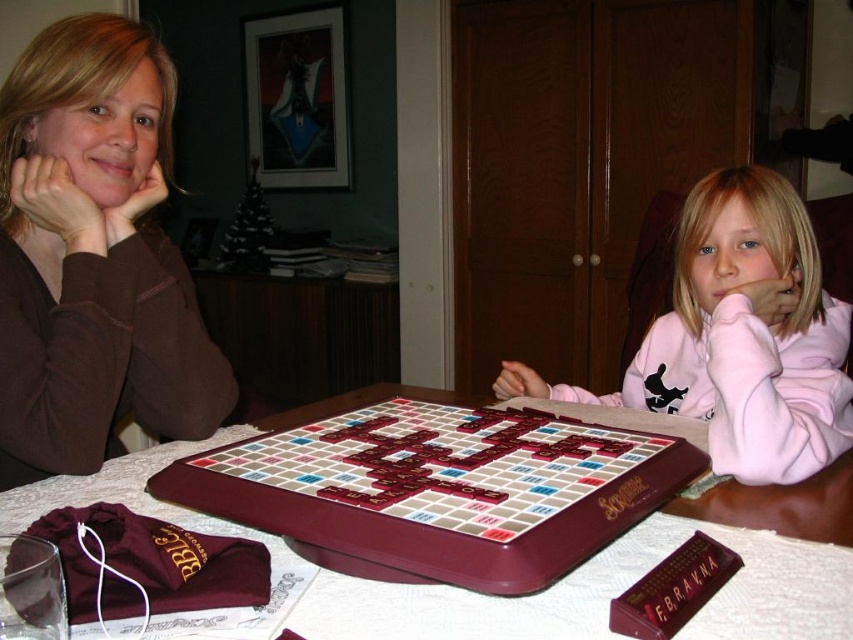
Question: Is maroon wooden table at center below maroon plastic scrabble board at center?

Choices:
 (A) yes
 (B) no

Answer: (A)

Question: Which point is farther to the camera?

Choices:
 (A) maroon wooden table at center
 (B) maroon plastic scrabble board at center

Answer: (B)

Question: Does brown fabric at left appear on the left side of pink fleece sweatshirt at right?

Choices:
 (A) yes
 (B) no

Answer: (A)

Question: Which point is closer to the camera?

Choices:
 (A) (733, 348)
 (B) (486, 438)
 (C) (82, 470)

Answer: (B)

Question: Is the position of brown fabric at left less distant than that of maroon wooden table at center?

Choices:
 (A) no
 (B) yes

Answer: (A)

Question: Which object is farther from the camera taking this photo?

Choices:
 (A) brown fabric at left
 (B) pink fleece sweatshirt at right
 (C) maroon wooden table at center

Answer: (B)